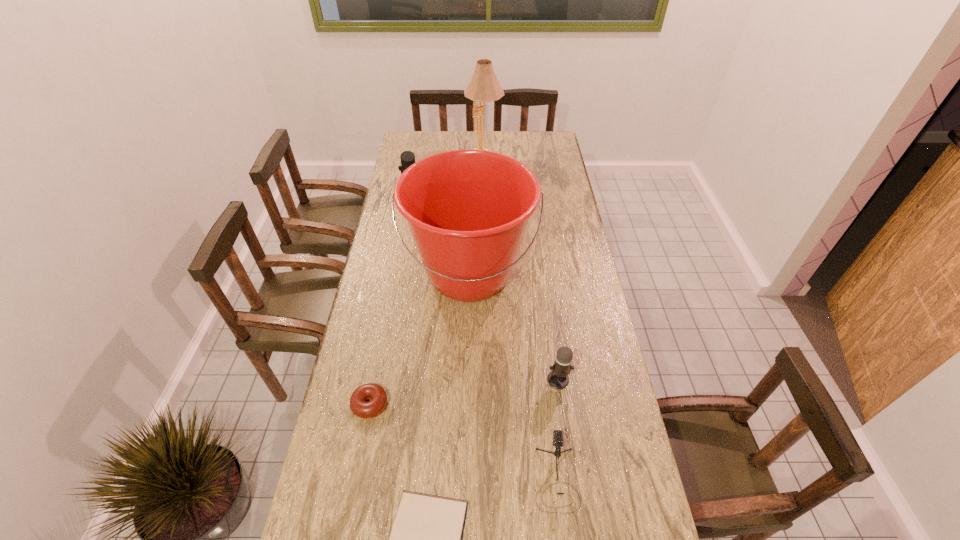
At what (x,y) coordinates should I click in order to perform the action: click on free location at the left edge. Please return your answer as a coordinate pair (x, y). This screenshot has height=540, width=960. Looking at the image, I should click on (363, 358).

Locate an element on the screen. free space at the right edge of the desktop is located at coordinates (558, 163).

Where is `vacant space at the far right corner of the desktop`? The width and height of the screenshot is (960, 540). vacant space at the far right corner of the desktop is located at coordinates (554, 146).

What are the coordinates of `free space between the fourth tallest object and the sixth shortest object` in the screenshot? It's located at (514, 327).

This screenshot has height=540, width=960. I want to click on free space between the second nearest microphone and the fifth nearest object, so click(514, 327).

Locate an element on the screen. This screenshot has width=960, height=540. free point between the third farthest object and the second farthest microphone is located at coordinates (514, 327).

Locate an element on the screen. The image size is (960, 540). unoccupied position between the farthest object and the second tallest microphone is located at coordinates (521, 266).

Locate an element on the screen. free space between the third farthest object and the second shortest object is located at coordinates (420, 340).

Select which object is the fifth closest to the bucket. Please provide its 2D coordinates. Your answer should be formatted as a tuple, i.e. [(x, y)], where the tuple contains the x and y coordinates of a point satisfying the conditions above.

[(426, 539)]

Where is `the sixth closest object to the fourth shortest object`? Image resolution: width=960 pixels, height=540 pixels. the sixth closest object to the fourth shortest object is located at coordinates (483, 87).